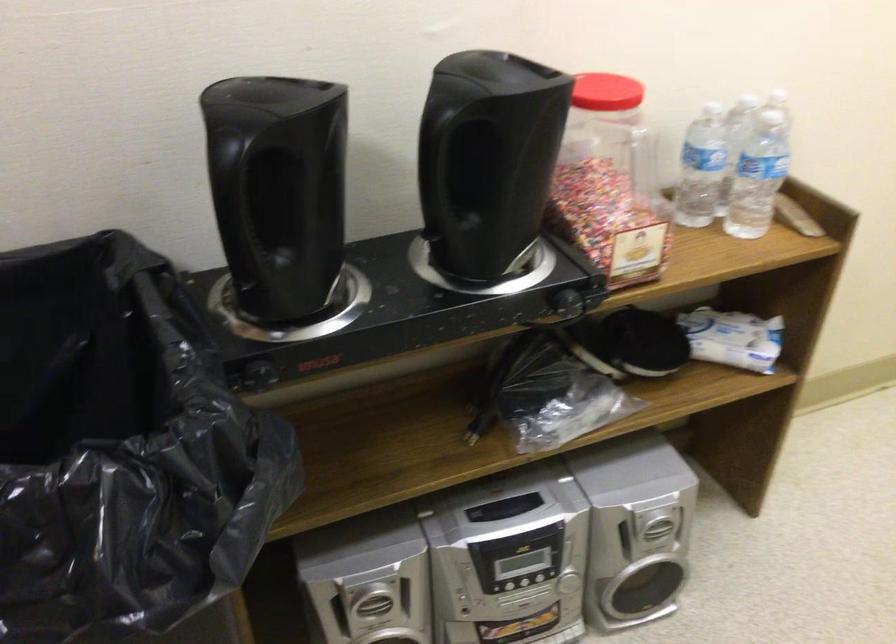
Identify the location of stereo system button. (373, 603).